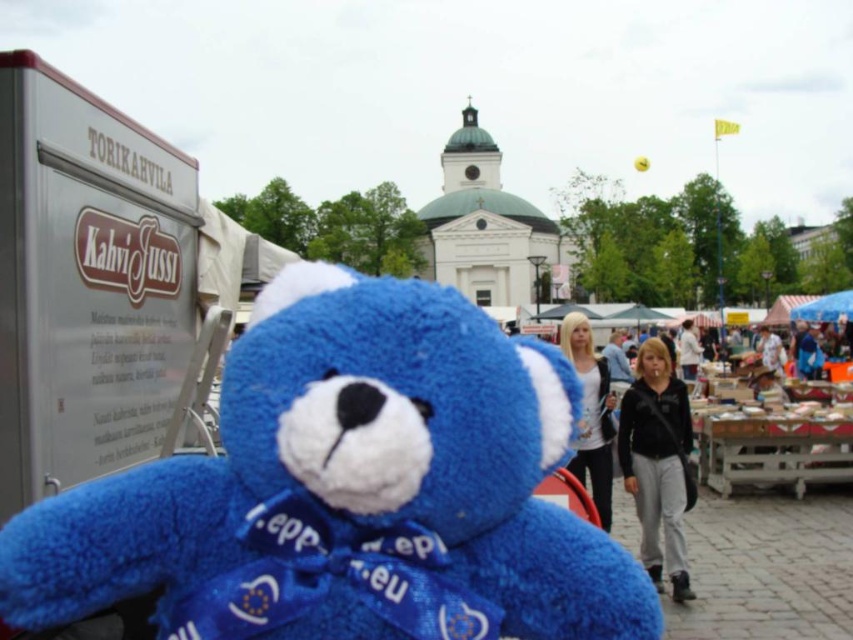
Question: Which object is positioned farthest from the black fleece jacket at center?

Choices:
 (A) white cotton jacket at center
 (B) light brown hair at center
 (C) blue plush bear at center
 (D) white cotton shirt at center

Answer: (C)

Question: Can you confirm if white cotton shirt at center is wider than white cotton jacket at center?

Choices:
 (A) yes
 (B) no

Answer: (A)

Question: Can you confirm if black fleece jacket at center is positioned to the right of white cotton jacket at center?

Choices:
 (A) yes
 (B) no

Answer: (B)

Question: Which of these objects is positioned farthest from the white cotton shirt at center?

Choices:
 (A) blue plush bear at center
 (B) light brown hair at center
 (C) black fleece jacket at center

Answer: (B)

Question: Which point appears closest to the camera in this image?

Choices:
 (A) (310, 486)
 (B) (677, 337)

Answer: (A)

Question: Does black fleece jacket at center appear on the right side of white cotton shirt at center?

Choices:
 (A) no
 (B) yes

Answer: (B)